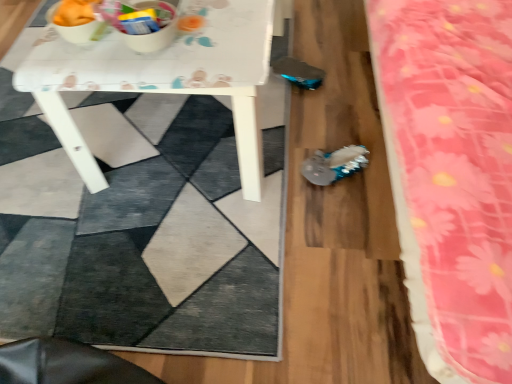
Question: Is shiny metallic shoe at center next to white glossy table at center?

Choices:
 (A) yes
 (B) no

Answer: (B)

Question: Does shiny metallic shoe at center have a larger size compared to white glossy table at center?

Choices:
 (A) yes
 (B) no

Answer: (B)

Question: Is shiny metallic shoe at center to the right of white glossy table at center from the viewer's perspective?

Choices:
 (A) no
 (B) yes

Answer: (B)

Question: Is shiny metallic shoe at center wider than white glossy table at center?

Choices:
 (A) yes
 (B) no

Answer: (B)

Question: Would you say shiny metallic shoe at center contains white glossy table at center?

Choices:
 (A) yes
 (B) no

Answer: (B)

Question: From the image's perspective, relative to shiny metallic shoe at center, is white glossy table at center above or below?

Choices:
 (A) below
 (B) above

Answer: (B)

Question: Is white glossy table at center taller or shorter than shiny metallic shoe at center?

Choices:
 (A) short
 (B) tall

Answer: (B)

Question: Looking at the image, does white glossy table at center seem bigger or smaller compared to shiny metallic shoe at center?

Choices:
 (A) small
 (B) big

Answer: (B)

Question: In terms of width, does white glossy table at center look wider or thinner when compared to shiny metallic shoe at center?

Choices:
 (A) wide
 (B) thin

Answer: (A)

Question: From a real-world perspective, relative to white glossy table at center, is shiny metallic shoe at center vertically above or below?

Choices:
 (A) below
 (B) above

Answer: (A)

Question: In terms of size, does shiny metallic shoe at center appear bigger or smaller than white glossy table at center?

Choices:
 (A) small
 (B) big

Answer: (A)

Question: Does point (312, 167) appear closer or farther from the camera than point (248, 49)?

Choices:
 (A) farther
 (B) closer

Answer: (A)

Question: From the image's perspective, is shiny metallic shoe at center located above or below white glossy table at center?

Choices:
 (A) above
 (B) below

Answer: (B)

Question: Is shiny metallic shoe at center bigger or smaller than pink floral fabric at right?

Choices:
 (A) small
 (B) big

Answer: (A)

Question: Visually, is shiny metallic shoe at center positioned to the left or to the right of pink floral fabric at right?

Choices:
 (A) left
 (B) right

Answer: (A)